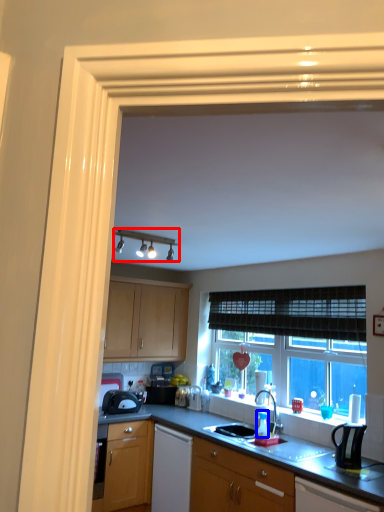
Question: Which point is closer to the camera, light fixture (highlighted by a red box) or bottle (highlighted by a blue box)?

Choices:
 (A) light fixture
 (B) bottle

Answer: (A)